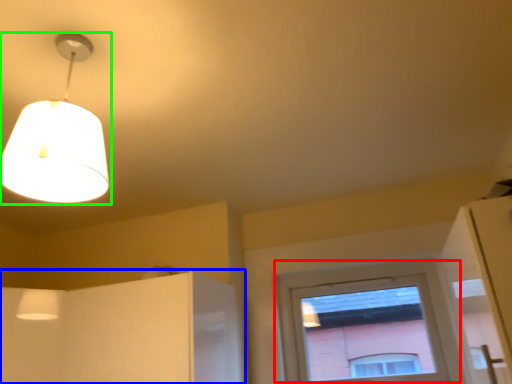
Question: Which object is positioned closest to window (highlighted by a red box)? Select from cabinetry (highlighted by a blue box) and lamp (highlighted by a green box).

Choices:
 (A) cabinetry
 (B) lamp

Answer: (A)